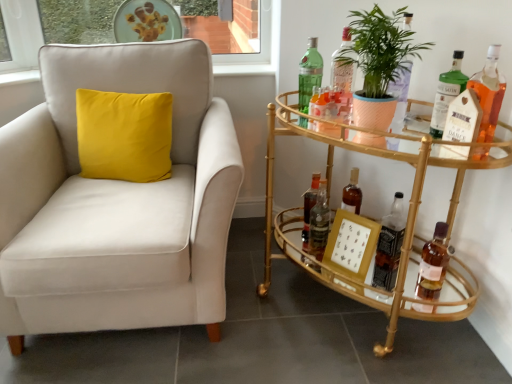
Find the location of a particular element. This screenshot has height=384, width=512. green matte plant at right is located at coordinates (380, 49).

Describe the element at coordinates (309, 74) in the screenshot. Image resolution: width=512 pixels, height=384 pixels. I see `green glass bottle at upper center, acting as the 8th bottle starting from the right` at that location.

Describe the element at coordinates (343, 67) in the screenshot. This screenshot has width=512, height=384. I see `green glass bottle at upper right, which appears as the 5th bottle when viewed from the right` at that location.

Describe the element at coordinates (309, 206) in the screenshot. This screenshot has width=512, height=384. I see `translucent glass bottle at center, acting as the second bottle starting from the left` at that location.

Identify the location of green matte plant at right. (380, 49).

Would you say green glass bottle at upper right, which appears as the 5th bottle when viewed from the right, is to the left or to the right of translucent glass bottle at center, which is the 7th bottle from right to left, in the picture?

Based on their positions, green glass bottle at upper right, which appears as the 5th bottle when viewed from the right, is located to the right of translucent glass bottle at center, which is the 7th bottle from right to left.

How many degrees apart are the facing directions of green glass bottle at upper right, which is the 4th bottle in left-to-right order, and translucent glass bottle at center, which is the 7th bottle from right to left?

3.34 degrees separate the facing orientations of green glass bottle at upper right, which is the 4th bottle in left-to-right order, and translucent glass bottle at center, which is the 7th bottle from right to left.

Does green glass bottle at upper right, which appears as the 5th bottle when viewed from the right, turn towards translucent glass bottle at center, which is the 7th bottle from right to left?

No, green glass bottle at upper right, which appears as the 5th bottle when viewed from the right, is not oriented towards translucent glass bottle at center, which is the 7th bottle from right to left.

Between suede beige armchair at left and green glass bottle at right, the 6th bottle from the left, which one has smaller width?

green glass bottle at right, the 6th bottle from the left.

From the image's perspective, is suede beige armchair at left located above or below green glass bottle at right, the 6th bottle from the left?

From the image's perspective, suede beige armchair at left appears below green glass bottle at right, the 6th bottle from the left.

Are suede beige armchair at left and green glass bottle at right, the third bottle from the right, making contact?

No, suede beige armchair at left is not touching green glass bottle at right, the third bottle from the right.

From a real-world perspective, is translucent glass bottle at center, which ranks as the sixth bottle in right-to-left order, below green glass bottle at right, the 6th bottle from the left?

Yes, from a real-world perspective, translucent glass bottle at center, which ranks as the sixth bottle in right-to-left order, is under green glass bottle at right, the 6th bottle from the left.

Are translucent glass bottle at center, acting as the 3th bottle starting from the left, and green glass bottle at right, the 6th bottle from the left, making contact?

No, translucent glass bottle at center, acting as the 3th bottle starting from the left, is not with green glass bottle at right, the 6th bottle from the left.

Does translucent glass bottle at center, which ranks as the sixth bottle in right-to-left order, turn towards green glass bottle at right, the 6th bottle from the left?

No, translucent glass bottle at center, which ranks as the sixth bottle in right-to-left order, is not facing towards green glass bottle at right, the 6th bottle from the left.

Between translucent glass bottle at center, which ranks as the sixth bottle in right-to-left order, and green glass bottle at right, the third bottle from the right, which one appears on the left side from the viewer's perspective?

translucent glass bottle at center, which ranks as the sixth bottle in right-to-left order.

Is gold glass bar cart at right to the left or to the right of translucent glass bottle at right, placed as the 1th bottle when sorted from right to left, in the image?

Clearly, gold glass bar cart at right is on the left of translucent glass bottle at right, placed as the 1th bottle when sorted from right to left, in the image.

Which of these two, gold glass bar cart at right or translucent glass bottle at right, which appears as the eighth bottle when viewed from the left, stands shorter?

translucent glass bottle at right, which appears as the eighth bottle when viewed from the left.

Is point (270, 181) less distant than point (488, 90)?

No, it is behind (488, 90).

Can you confirm if gold glass bar cart at right is thinner than translucent glass bottle at right, which appears as the eighth bottle when viewed from the left?

In fact, gold glass bar cart at right might be wider than translucent glass bottle at right, which appears as the eighth bottle when viewed from the left.

Choose the correct answer: Is translucent amber glass bottle at lower right, positioned as the seventh bottle in left-to-right order, inside green glass bottle at right, the third bottle from the right, or outside it?

translucent amber glass bottle at lower right, positioned as the seventh bottle in left-to-right order, is not inside green glass bottle at right, the third bottle from the right, it's outside.

From their relative heights in the image, would you say translucent amber glass bottle at lower right, positioned as the seventh bottle in left-to-right order, is taller or shorter than green glass bottle at right, the 6th bottle from the left?

Clearly, translucent amber glass bottle at lower right, positioned as the seventh bottle in left-to-right order, is shorter compared to green glass bottle at right, the 6th bottle from the left.

Considering the relative positions of translucent amber glass bottle at lower right, positioned as the seventh bottle in left-to-right order, and green glass bottle at right, the third bottle from the right, in the image provided, is translucent amber glass bottle at lower right, positioned as the seventh bottle in left-to-right order, to the right of green glass bottle at right, the third bottle from the right, from the viewer's perspective?

Yes.

From the image's perspective, who appears lower, translucent amber glass bottle at lower right, positioned as the second bottle in right-to-left order, or green glass bottle at right, the 6th bottle from the left?

translucent amber glass bottle at lower right, positioned as the second bottle in right-to-left order, is shown below in the image.

In the scene shown: Can you tell me how much green matte plant at right and translucent glass bottle at center, which is the 7th bottle from right to left, differ in facing direction?

7.16 degrees.

Considering the sizes of objects green matte plant at right and translucent glass bottle at center, which is the 7th bottle from right to left, in the image provided, who is taller, green matte plant at right or translucent glass bottle at center, which is the 7th bottle from right to left,?

green matte plant at right is taller.

Is green matte plant at right next to translucent glass bottle at center, acting as the second bottle starting from the left?

No, green matte plant at right is not with translucent glass bottle at center, acting as the second bottle starting from the left.

Which of these two, green matte plant at right or translucent glass bottle at center, acting as the second bottle starting from the left, is smaller?

With smaller size is translucent glass bottle at center, acting as the second bottle starting from the left.

From a real-world perspective, is green glass bottle at upper right, which appears as the 5th bottle when viewed from the right, beneath green glass bottle at right, the third bottle from the right?

No, from a real-world perspective, green glass bottle at upper right, which appears as the 5th bottle when viewed from the right, is not under green glass bottle at right, the third bottle from the right.

Is green glass bottle at upper right, which is the 4th bottle in left-to-right order, turned away from green glass bottle at right, the third bottle from the right?

No.

From the image's perspective, count 2nd bottles upward from the green glass bottle at right, the third bottle from the right, and point to it. Please provide its 2D coordinates.

[(343, 67)]

Starting from the translucent glass bottle at center, which is the 7th bottle from right to left, which bottle is the 4th one in front? Please provide its 2D coordinates.

[(343, 67)]

Starting from the suede beige armchair at left, which bottle is the 2nd one behind? Please provide its 2D coordinates.

[(447, 93)]

From the image, which object appears to be farther from suede beige armchair at left, translucent glass bottle at center, the fifth bottle when ordered from left to right, or translucent glass bottle at center, acting as the 3th bottle starting from the left?

translucent glass bottle at center, the fifth bottle when ordered from left to right, is positioned further to the anchor suede beige armchair at left.

Looking at the image, which one is located closer to translucent glass bottle at center, which is the 7th bottle from right to left, translucent amber glass bottle at lower right, positioned as the second bottle in right-to-left order, or green matte plant at right?

The object closer to translucent glass bottle at center, which is the 7th bottle from right to left, is translucent amber glass bottle at lower right, positioned as the second bottle in right-to-left order.

Considering their positions, is translucent amber glass bottle at lower right, positioned as the seventh bottle in left-to-right order, positioned further to translucent glass bottle at center, which is the 4th bottle from right to left, than translucent glass bottle at right, placed as the 1th bottle when sorted from right to left?

Answer: translucent glass bottle at right, placed as the 1th bottle when sorted from right to left, lies further to translucent glass bottle at center, which is the 4th bottle from right to left, than the other object.

From the image, which object appears to be nearer to translucent glass bottle at center, acting as the 3th bottle starting from the left, translucent amber glass bottle at lower right, positioned as the second bottle in right-to-left order, or gold glass bar cart at right?

gold glass bar cart at right is positioned closer to the anchor translucent glass bottle at center, acting as the 3th bottle starting from the left.

Considering their positions, is translucent amber glass bottle at lower right, positioned as the second bottle in right-to-left order, positioned closer to gold glass bar cart at right than green matte plant at right?

translucent amber glass bottle at lower right, positioned as the second bottle in right-to-left order, is positioned closer to the anchor gold glass bar cart at right.

When comparing their distances from gold glass bar cart at right, does translucent amber glass bottle at lower right, positioned as the second bottle in right-to-left order, or translucent glass bottle at right, which appears as the eighth bottle when viewed from the left, seem closer?

translucent amber glass bottle at lower right, positioned as the second bottle in right-to-left order, is closer to gold glass bar cart at right.

From the image, which object appears to be nearer to suede beige armchair at left, translucent glass bottle at center, which is the 4th bottle from right to left, or translucent amber glass bottle at lower right, positioned as the seventh bottle in left-to-right order?

The object closer to suede beige armchair at left is translucent glass bottle at center, which is the 4th bottle from right to left.

In the scene shown: Considering their positions, is translucent glass bottle at center, acting as the 3th bottle starting from the left, positioned closer to green glass bottle at upper right, which is the 4th bottle in left-to-right order, than green glass bottle at upper center, acting as the 8th bottle starting from the right?

The object closer to green glass bottle at upper right, which is the 4th bottle in left-to-right order, is green glass bottle at upper center, acting as the 8th bottle starting from the right.

Find the location of a particular element. This screenshot has width=512, height=384. table between green glass bottle at upper right, which is the 4th bottle in left-to-right order, and translucent amber glass bottle at lower right, positioned as the seventh bottle in left-to-right order, vertically is located at coordinates (407, 220).

Locate an element on the screen. houseplant that lies between green glass bottle at upper center, the 1th bottle positioned from the left, and translucent glass bottle at center, acting as the 3th bottle starting from the left, from top to bottom is located at coordinates (380, 49).

You are a GUI agent. You are given a task and a screenshot of the screen. Output one action in this format:
    pyautogui.click(x=<x>, y=<y>)
    Task: Click on the table that lies between green glass bottle at upper center, acting as the 8th bottle starting from the right, and translucent glass bottle at center, the fifth bottle when ordered from left to right, from top to bottom
    The height and width of the screenshot is (384, 512).
    Given the screenshot: What is the action you would take?
    pyautogui.click(x=407, y=220)

This screenshot has width=512, height=384. In order to click on houseplant between suede beige armchair at left and gold glass bar cart at right from left to right in this screenshot , I will do `click(380, 49)`.